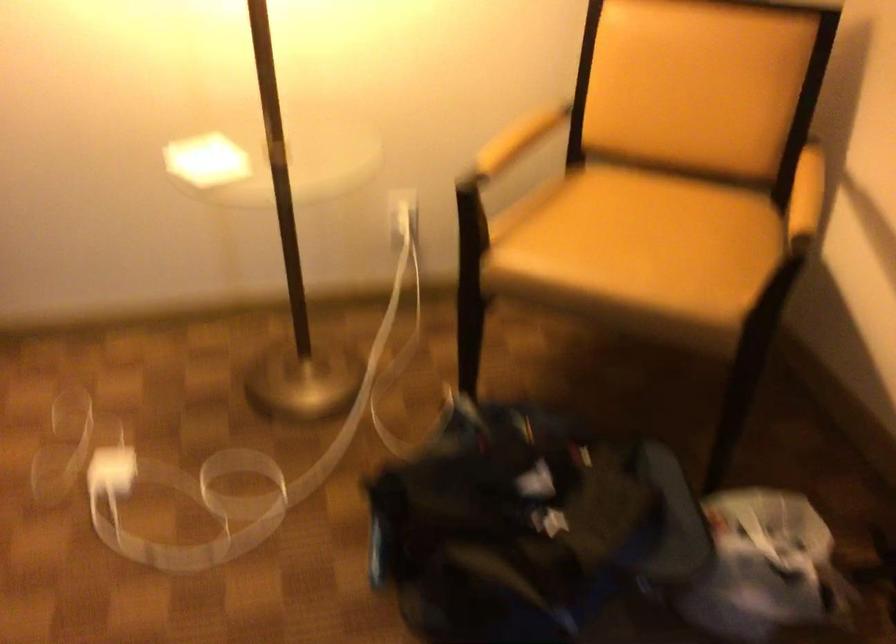
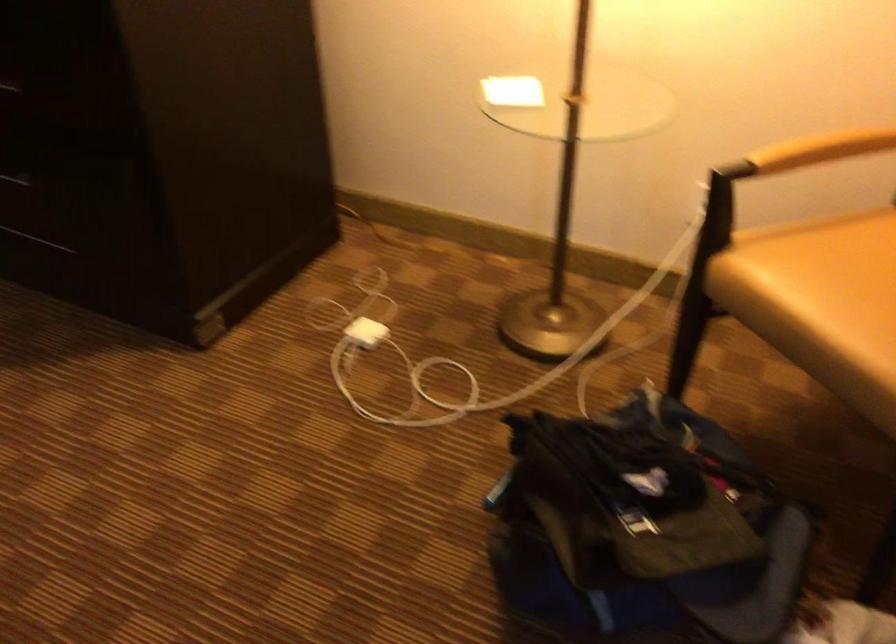
Question: Based on the continuous images, in which direction is the camera rotating? Reply with the corresponding letter.

Choices:
 (A) Left
 (B) Right
 (C) Up
 (D) Down

Answer: (A)